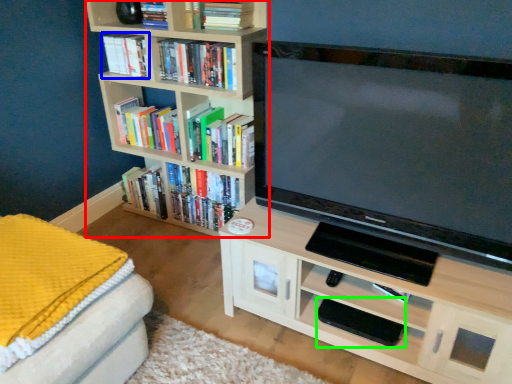
Question: Which object is positioned closest to bookcase (highlighted by a red box)? Select from book (highlighted by a blue box) and pad (highlighted by a green box).

Choices:
 (A) book
 (B) pad

Answer: (A)